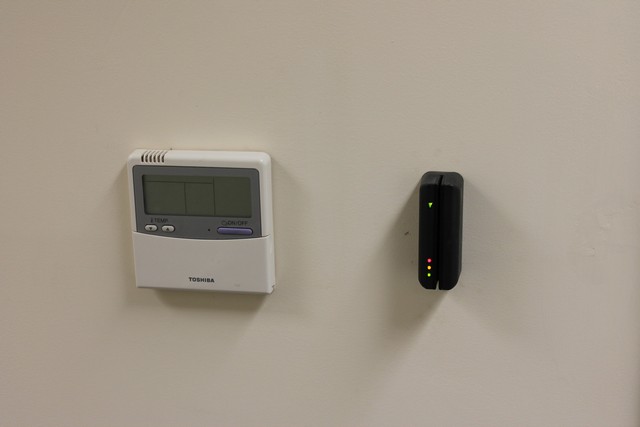
At what (x,y) coordinates should I click in order to perform the action: click on blank screen. Please return your answer as a coordinate pair (x, y). The width and height of the screenshot is (640, 427). Looking at the image, I should click on (159, 196), (194, 197), (236, 200).